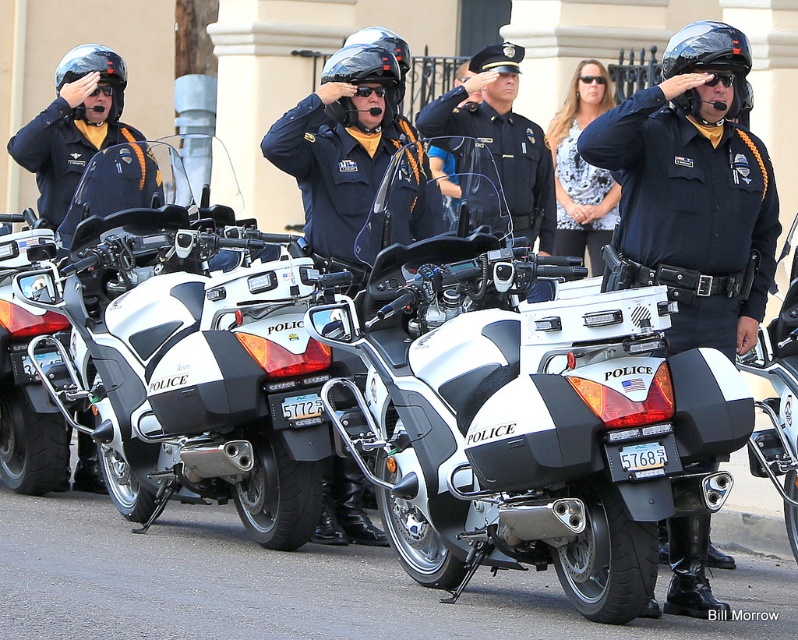
You are a photographer taking a picture of the police officers and motorcycles. You notice two points in the scene at coordinates point [219,326] and point [681,45]. Which point is closer to your camera lens?

Point [219,326] is further to the camera than point [681,45], so the point closer to the camera lens is point [681,45].

You are a delivery person who needs to place a glossy black helmet at center and a white matte police motorcycle at center into a storage container. The container has a width of 1.2 meters. Can both items fit side by side without overlapping?

The white matte police motorcycle at center might be wider than glossy black helmet at center. If the motorcycle is wider than 1.2 meters, they cannot fit side by side. If it is narrower, both could fit depending on the helmet size.